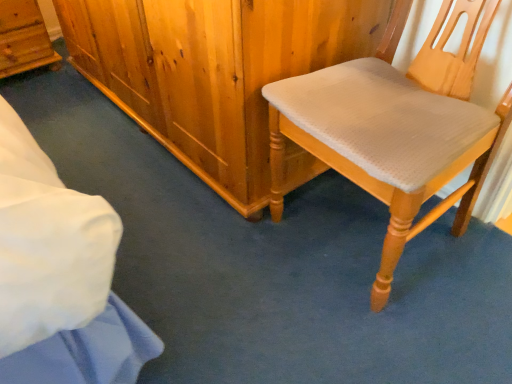
In order to click on vacant space to the left of light wood/texture chair at right in this screenshot , I will do `click(216, 257)`.